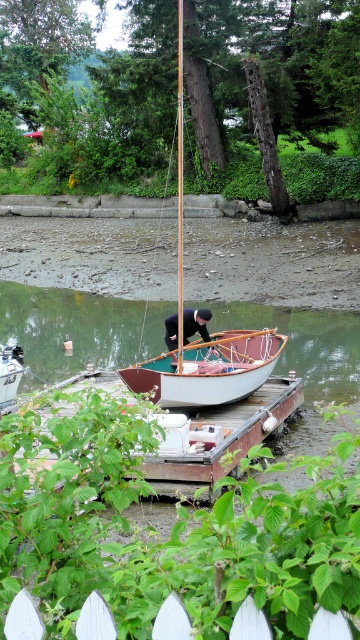
Question: Among these points, which one is farthest from the camera?

Choices:
 (A) (21, 368)
 (B) (158, 625)
 (C) (150, 374)
 (D) (275, 401)

Answer: (A)

Question: Is smooth wooden boat at center bigger than white wooden picket fence at lower center?

Choices:
 (A) yes
 (B) no

Answer: (A)

Question: Considering the real-world distances, which object is closest to the smooth wooden boat at center?

Choices:
 (A) white wooden picket fence at lower center
 (B) white wood boat at center

Answer: (B)

Question: Does wooden dock at center appear on the left side of white wood boat at center?

Choices:
 (A) no
 (B) yes

Answer: (A)

Question: Does smooth wooden boat at center have a larger size compared to white wood boat at center?

Choices:
 (A) no
 (B) yes

Answer: (B)

Question: Which object is the closest to the smooth wooden boat at center?

Choices:
 (A) white wood boat at center
 (B) wooden dock at center

Answer: (A)